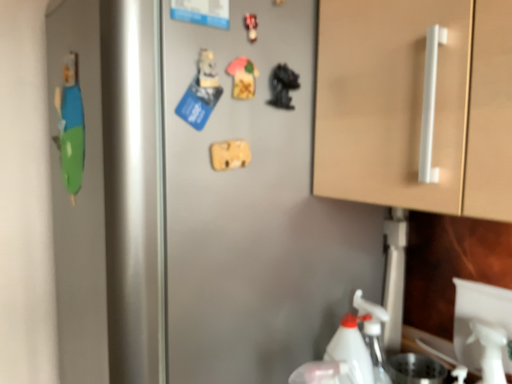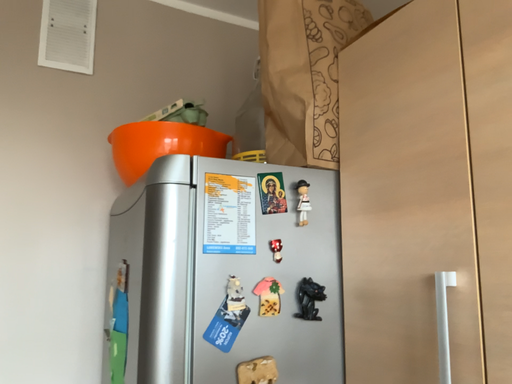
Question: Which way did the camera rotate in the video?

Choices:
 (A) rotated downward
 (B) rotated upward

Answer: (B)